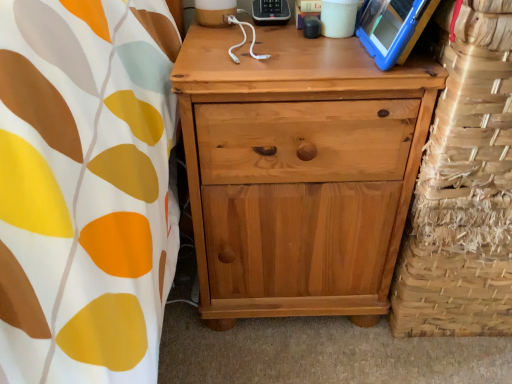
Identify the location of free spot above natural wood chest of drawers at center (from a real-world perspective). (303, 57).